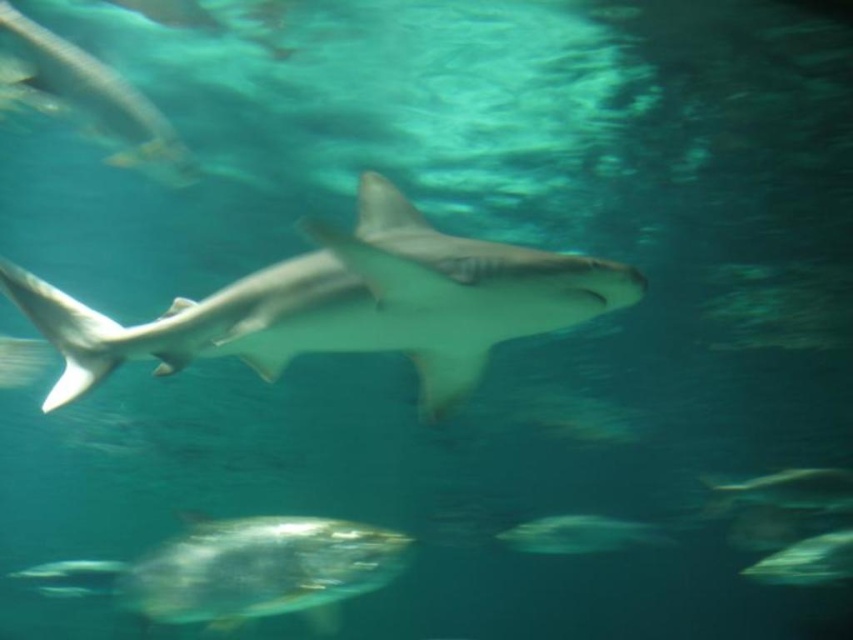
Question: Is translucent gray shark at upper left smaller than translucent gray fish at lower right?

Choices:
 (A) yes
 (B) no

Answer: (B)

Question: Among these objects, which one is nearest to the camera?

Choices:
 (A) green translucent fish at lower right
 (B) translucent glass fish at lower center
 (C) translucent gray shark at upper left
 (D) smooth gray shark at center

Answer: (D)

Question: Which of the following is the closest to the observer?

Choices:
 (A) translucent gray fish at lower right
 (B) green translucent fish at lower right
 (C) translucent gray fish at center
 (D) smooth gray shark at center

Answer: (D)

Question: Can you confirm if translucent glass fish at lower center is smaller than translucent gray fish at center?

Choices:
 (A) no
 (B) yes

Answer: (B)

Question: Can you confirm if translucent glass fish at lower center is positioned to the left of translucent gray fish at lower right?

Choices:
 (A) yes
 (B) no

Answer: (A)

Question: Which point appears farthest from the camera in this image?

Choices:
 (A) (541, 276)
 (B) (604, 545)
 (C) (28, 54)
 (D) (236, 561)

Answer: (B)